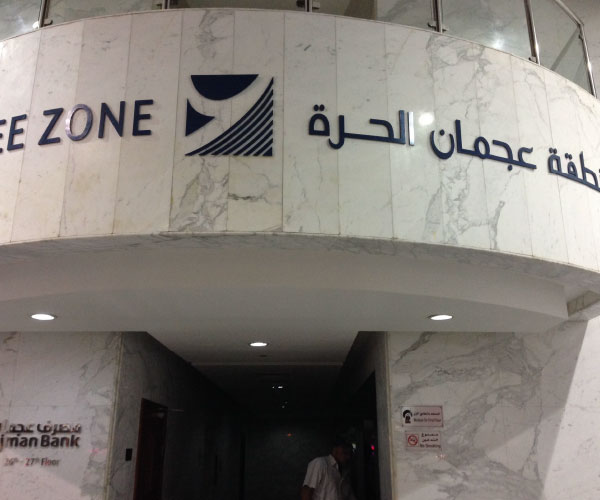
Where is `hall`? hall is located at coordinates (238, 438).